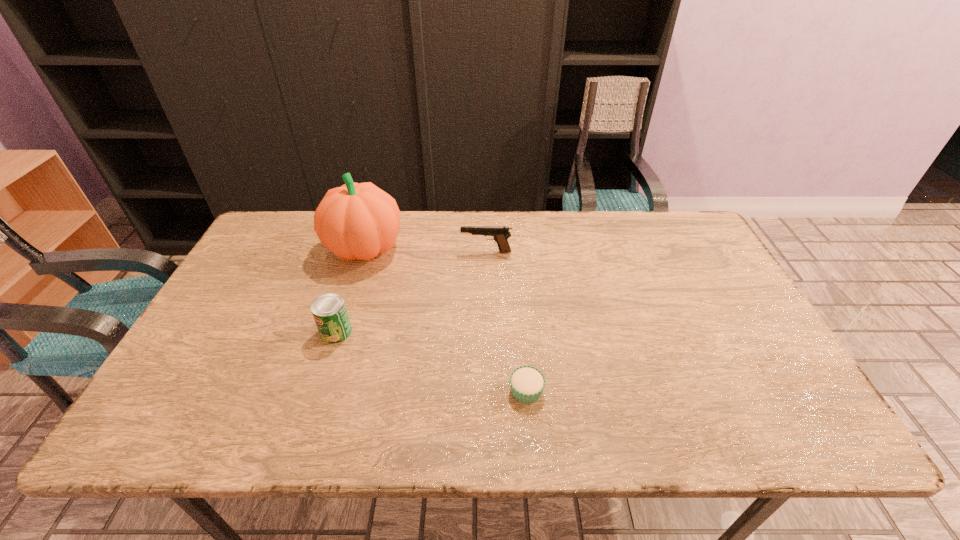
This screenshot has width=960, height=540. What are the coordinates of `object that ranks as the third closest to the can` in the screenshot? It's located at (527, 383).

Identify which object is located as the third nearest to the nearest object. Please provide its 2D coordinates. Your answer should be formatted as a tuple, i.e. [(x, y)], where the tuple contains the x and y coordinates of a point satisfying the conditions above.

[(358, 221)]

At what (x,y) coordinates should I click in order to perform the action: click on free spot that satisfies the following two spatial constraints: 1. on the front side of the cupcake; 2. on the right side of the tallest object. Please return your answer as a coordinate pair (x, y). This screenshot has height=540, width=960. Looking at the image, I should click on (320, 390).

At what (x,y) coordinates should I click in order to perform the action: click on free location that satisfies the following two spatial constraints: 1. at the muzzle of the pistol; 2. on the right side of the cupcake. Please return your answer as a coordinate pair (x, y). This screenshot has width=960, height=540. Looking at the image, I should click on (489, 390).

Find the location of a particular element. The image size is (960, 540). vacant area that satisfies the following two spatial constraints: 1. at the muzzle of the pistol; 2. on the back side of the cupcake is located at coordinates (489, 390).

You are a GUI agent. You are given a task and a screenshot of the screen. Output one action in this format:
    pyautogui.click(x=<x>, y=<y>)
    Task: Click on the blank space that satisfies the following two spatial constraints: 1. at the muzzle of the pistol; 2. on the front side of the second nearest object
    Image resolution: width=960 pixels, height=540 pixels.
    Given the screenshot: What is the action you would take?
    pyautogui.click(x=488, y=332)